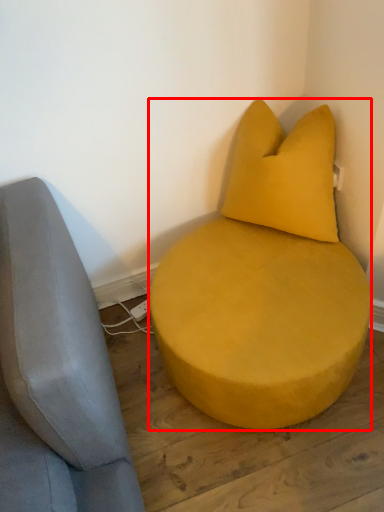
Question: From the image's perspective, what is the correct spatial positioning of furniture (annotated by the red box) in reference to pillow?

Choices:
 (A) below
 (B) above

Answer: (A)